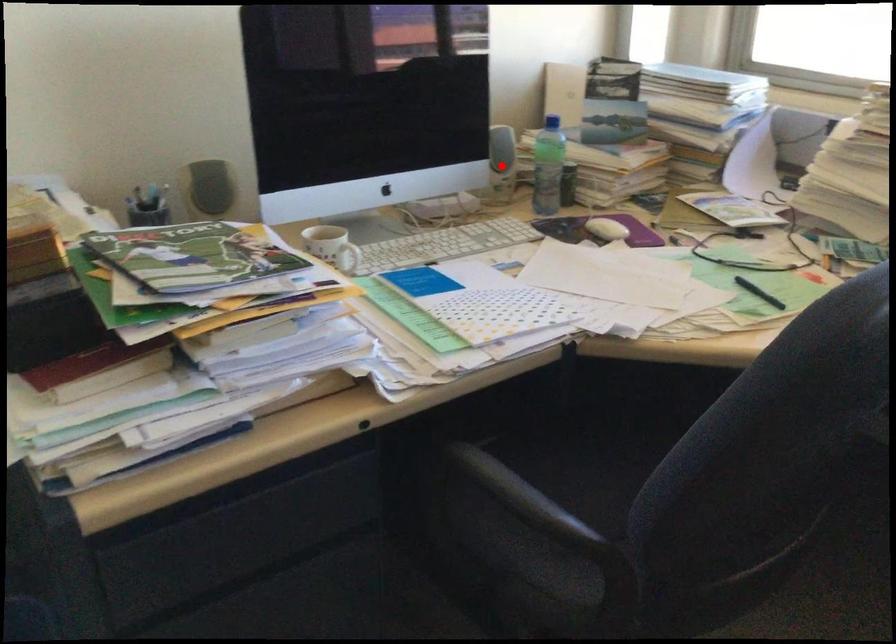
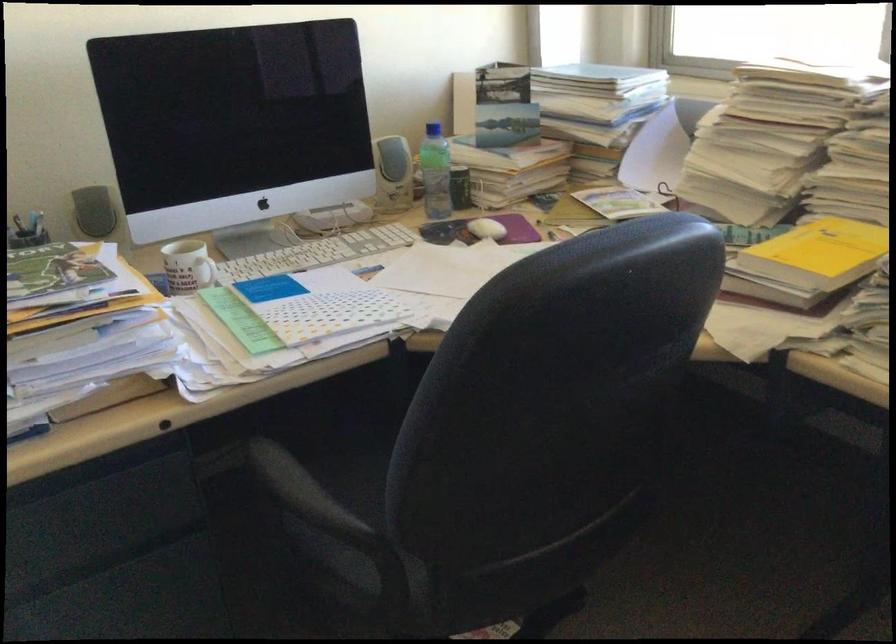
Where in the second image is the point corresponding to the highlighted location from the first image?

(392, 174)